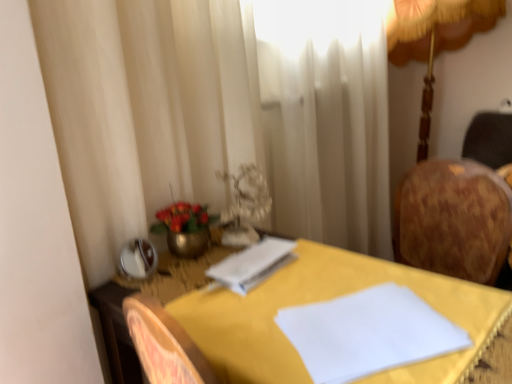
Identify the location of vacant area situated to the left side of white paper at center. This screenshot has width=512, height=384. (182, 285).